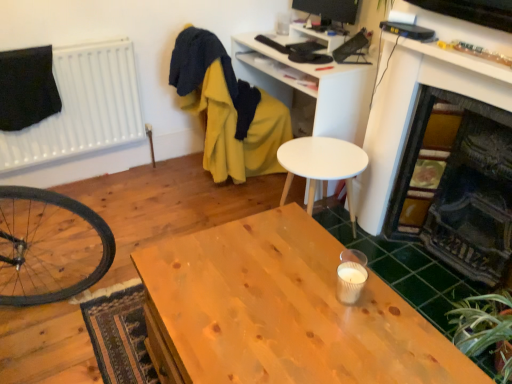
Question: Can you confirm if green leafy plant at lower right is shorter than white matte computer desk at upper center?

Choices:
 (A) no
 (B) yes

Answer: (B)

Question: Is white matte computer desk at upper center surrounded by green leafy plant at lower right?

Choices:
 (A) yes
 (B) no

Answer: (B)

Question: From the image's perspective, is green leafy plant at lower right located beneath white matte computer desk at upper center?

Choices:
 (A) no
 (B) yes

Answer: (B)

Question: Is green leafy plant at lower right taller than white matte computer desk at upper center?

Choices:
 (A) no
 (B) yes

Answer: (A)

Question: Does green leafy plant at lower right have a lesser width compared to white matte computer desk at upper center?

Choices:
 (A) yes
 (B) no

Answer: (A)

Question: From the image's perspective, is wooden table at center above or below white matte computer desk at upper center?

Choices:
 (A) below
 (B) above

Answer: (A)

Question: Is wooden table at center taller or shorter than white matte computer desk at upper center?

Choices:
 (A) short
 (B) tall

Answer: (A)

Question: From a real-world perspective, is wooden table at center physically located above or below white matte computer desk at upper center?

Choices:
 (A) above
 (B) below

Answer: (B)

Question: In the image, is wooden table at center positioned in front of or behind white matte computer desk at upper center?

Choices:
 (A) front
 (B) behind

Answer: (A)

Question: Choose the correct answer: Is wooden table at center inside green leafy plant at lower right or outside it?

Choices:
 (A) outside
 (B) inside

Answer: (A)

Question: Relative to green leafy plant at lower right, is wooden table at center in front or behind?

Choices:
 (A) behind
 (B) front

Answer: (B)

Question: Considering the positions of wooden table at center and green leafy plant at lower right in the image, is wooden table at center bigger or smaller than green leafy plant at lower right?

Choices:
 (A) small
 (B) big

Answer: (B)

Question: Is wooden table at center to the left or to the right of green leafy plant at lower right in the image?

Choices:
 (A) left
 (B) right

Answer: (A)

Question: From the image's perspective, relative to dark gray stone fireplace at right, is wooden table at center above or below?

Choices:
 (A) below
 (B) above

Answer: (A)

Question: In the image, is wooden table at center positioned in front of or behind dark gray stone fireplace at right?

Choices:
 (A) front
 (B) behind

Answer: (A)